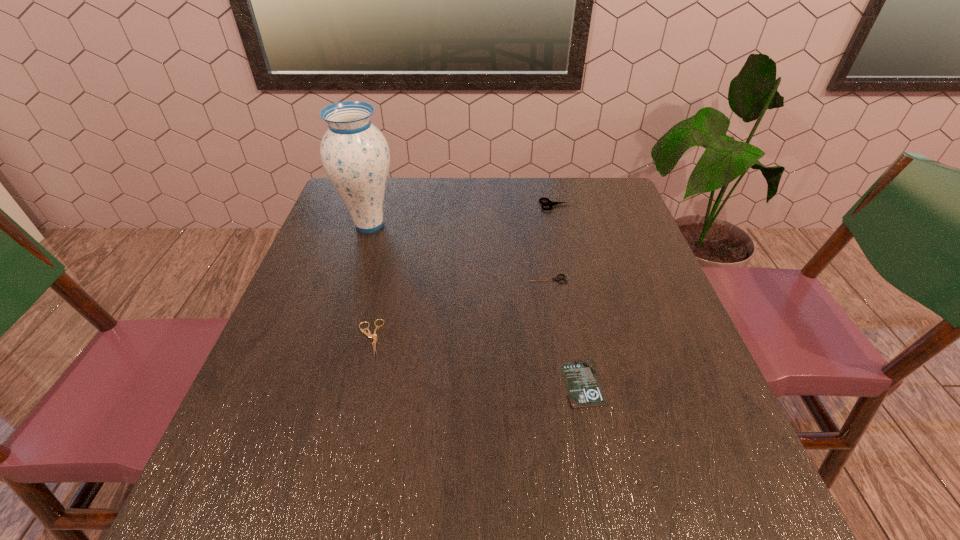
Find the location of `free space between the shortest object and the farthest shears`. free space between the shortest object and the farthest shears is located at coordinates (570, 294).

This screenshot has height=540, width=960. Identify the location of free spot between the vase and the identity card. (476, 304).

Find the location of a particular element. The height and width of the screenshot is (540, 960). unoccupied position between the leftmost shears and the tallest object is located at coordinates (370, 281).

Locate an element on the screen. This screenshot has height=540, width=960. free space between the second nearest shears and the nearest object is located at coordinates (565, 331).

You are a GUI agent. You are given a task and a screenshot of the screen. Output one action in this format:
    pyautogui.click(x=<x>, y=<y>)
    Task: Click on the free space between the nearest shears and the nearest object
    
    Given the screenshot: What is the action you would take?
    pyautogui.click(x=476, y=361)

Identify the location of object that is the fourth closest to the tallest shears. (369, 335).

Choose which object is the third nearest neighbor to the shortest object. Please provide its 2D coordinates. Your answer should be formatted as a tuple, i.e. [(x, y)], where the tuple contains the x and y coordinates of a point satisfying the conditions above.

[(550, 203)]

You are a GUI agent. You are given a task and a screenshot of the screen. Output one action in this format:
    pyautogui.click(x=<x>, y=<y>)
    Task: Click on the shears object that ranks as the closest to the second farthest shears
    Image resolution: width=960 pixels, height=540 pixels.
    Given the screenshot: What is the action you would take?
    pyautogui.click(x=550, y=203)

Identify which shears is the second closest to the third farthest object. Please provide its 2D coordinates. Your answer should be formatted as a tuple, i.e. [(x, y)], where the tuple contains the x and y coordinates of a point satisfying the conditions above.

[(369, 335)]

Where is `free spot that satisfies the following two spatial constraints: 1. on the back side of the nearest object; 2. on the right side of the tallest shears`? free spot that satisfies the following two spatial constraints: 1. on the back side of the nearest object; 2. on the right side of the tallest shears is located at coordinates (546, 205).